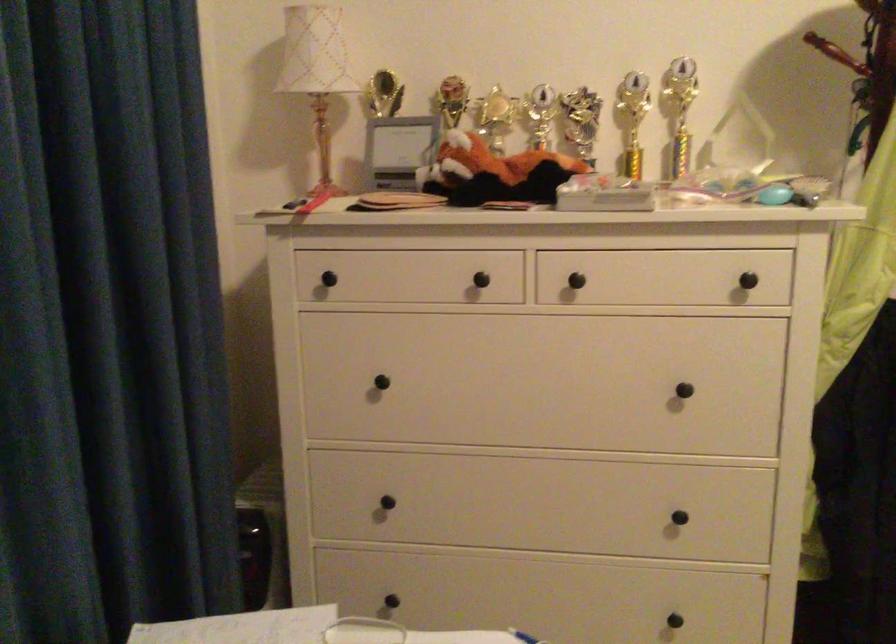
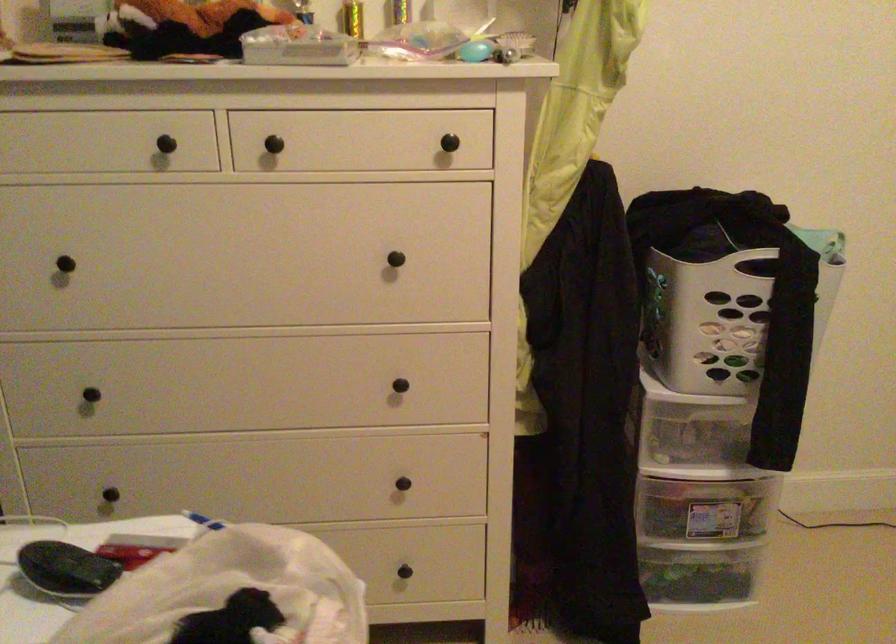
The point at (778,196) is marked in the first image. Where is the corresponding point in the second image?

(475, 51)